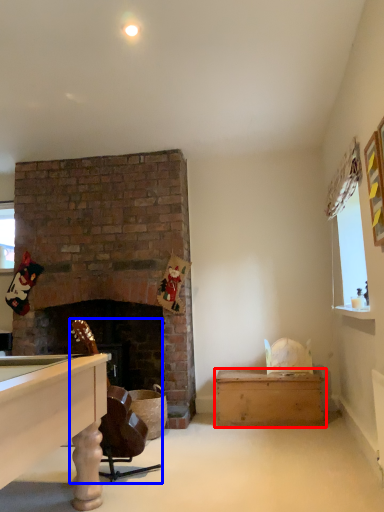
Question: Among these objects, which one is farthest to the camera, table (highlighted by a red box) or rocking chair (highlighted by a blue box)?

Choices:
 (A) table
 (B) rocking chair

Answer: (A)